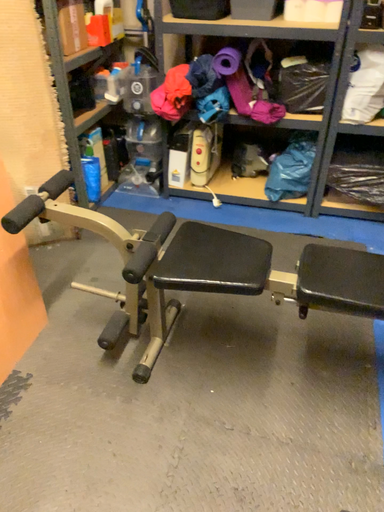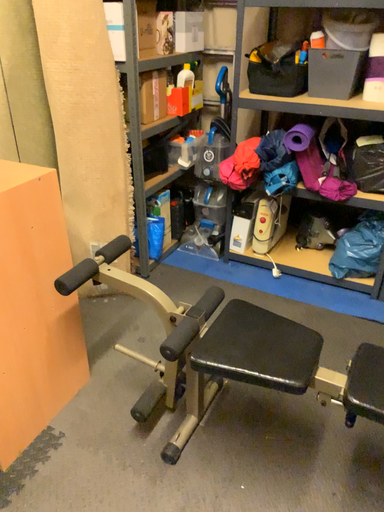
Question: How did the camera likely rotate when shooting the video?

Choices:
 (A) rotated downward
 (B) rotated upward

Answer: (B)